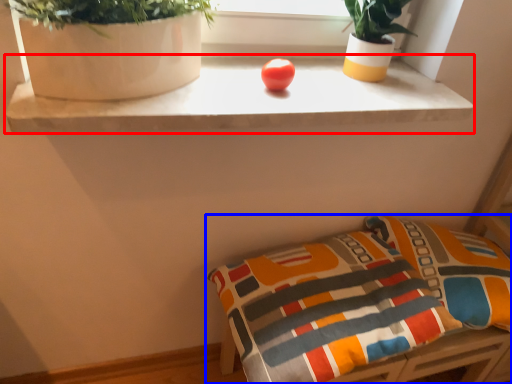
Question: Which point is further to the camera, table (highlighted by a red box) or furniture (highlighted by a blue box)?

Choices:
 (A) table
 (B) furniture

Answer: (B)